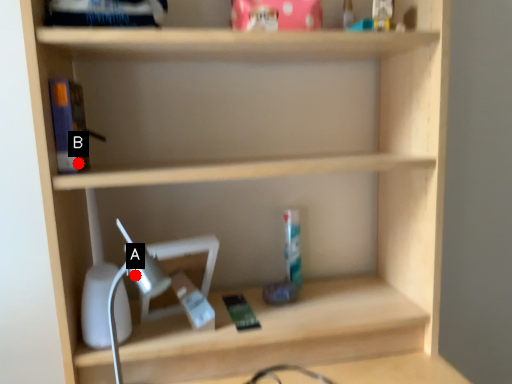
Question: Two points are circled on the image, labeled by A and B beside each circle. Which of the following is the closest to the observer?

Choices:
 (A) A is closer
 (B) B is closer

Answer: (A)